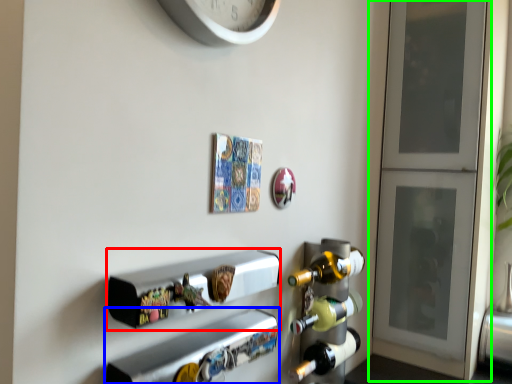
Question: Based on their relative distances, which object is nearer to shelf (highlighted by a red box)? Choose from shelf (highlighted by a blue box) and door (highlighted by a green box).

Choices:
 (A) shelf
 (B) door

Answer: (A)